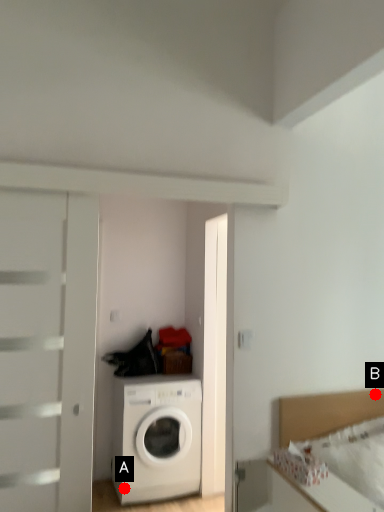
Question: Two points are circled on the image, labeled by A and B beside each circle. Among these points, which one is nearest to the camera?

Choices:
 (A) A is closer
 (B) B is closer

Answer: (B)